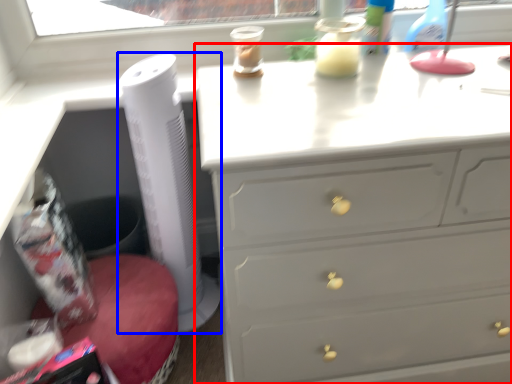
Question: Which object appears closest to the camera in this image, chest of drawers (highlighted by a red box) or appliance (highlighted by a blue box)?

Choices:
 (A) chest of drawers
 (B) appliance

Answer: (A)